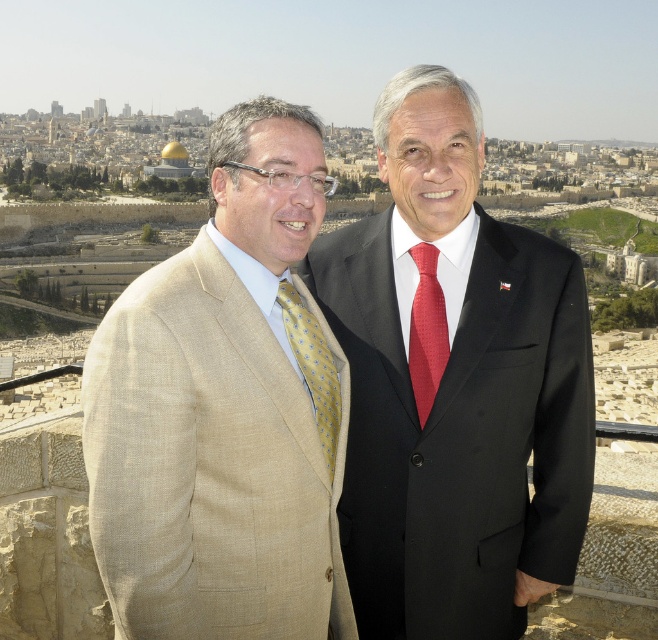
Who is more forward, (320, 380) or (413, 355)?

Point (320, 380) is more forward.

Does point (295, 304) come in front of point (426, 403)?

No, it is behind (426, 403).

This screenshot has height=640, width=658. What do you see at coordinates (313, 368) in the screenshot?
I see `yellow dotted silk tie at center` at bounding box center [313, 368].

Identify the location of yellow dotted silk tie at center. The height and width of the screenshot is (640, 658). (313, 368).

Who is higher up, black wool suit at center or beige linen suit at left?

Positioned higher is black wool suit at center.

Which is in front, point (505, 275) or point (240, 397)?

Positioned in front is point (240, 397).

I want to click on black wool suit at center, so click(461, 433).

Is black wool suit at center to the right of red textured tie at center from the viewer's perspective?

Yes, black wool suit at center is to the right of red textured tie at center.

Describe the element at coordinates (461, 433) in the screenshot. I see `black wool suit at center` at that location.

Is point (418, 595) in front of point (432, 323)?

Yes.

Locate an element on the screen. This screenshot has width=658, height=640. black wool suit at center is located at coordinates (461, 433).